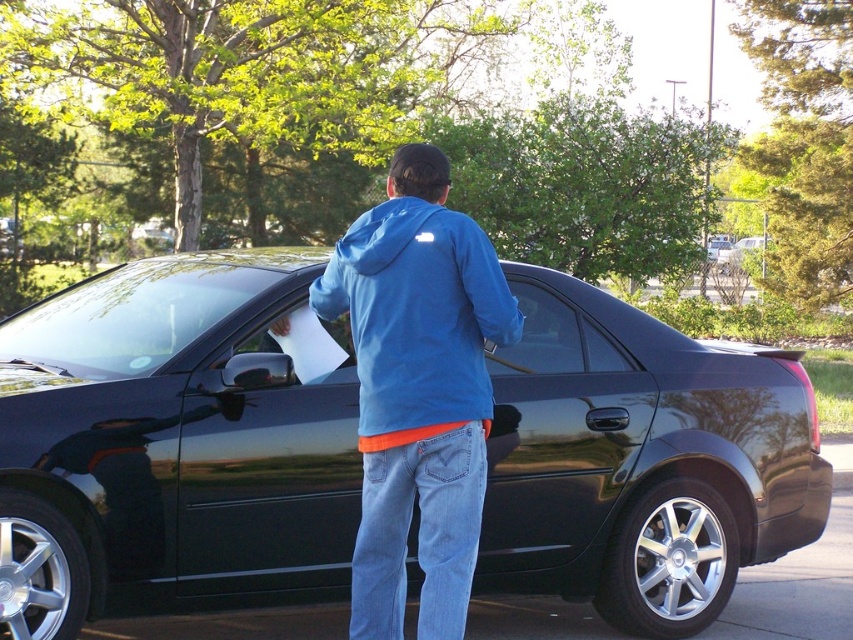
Question: Does glossy black car at center appear under blue cotton hoodie at center?

Choices:
 (A) no
 (B) yes

Answer: (B)

Question: Which object appears farthest from the camera in this image?

Choices:
 (A) blue cotton hoodie at center
 (B) blue fleece sweatshirt at center

Answer: (A)

Question: Which of the following is the farthest from the observer?

Choices:
 (A) blue fleece sweatshirt at center
 (B) blue cotton hoodie at center
 (C) glossy black car at center

Answer: (C)

Question: Is glossy black car at center to the left of blue cotton hoodie at center from the viewer's perspective?

Choices:
 (A) no
 (B) yes

Answer: (B)

Question: Estimate the real-world distances between objects in this image. Which object is farther from the blue cotton hoodie at center?

Choices:
 (A) blue fleece sweatshirt at center
 (B) glossy black car at center

Answer: (B)

Question: Does glossy black car at center have a larger size compared to blue cotton hoodie at center?

Choices:
 (A) yes
 (B) no

Answer: (A)